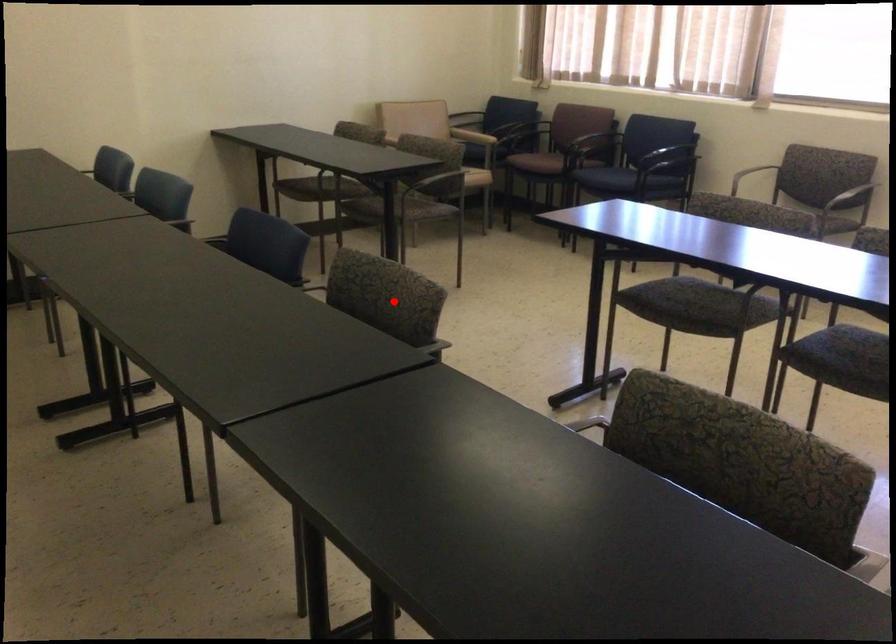
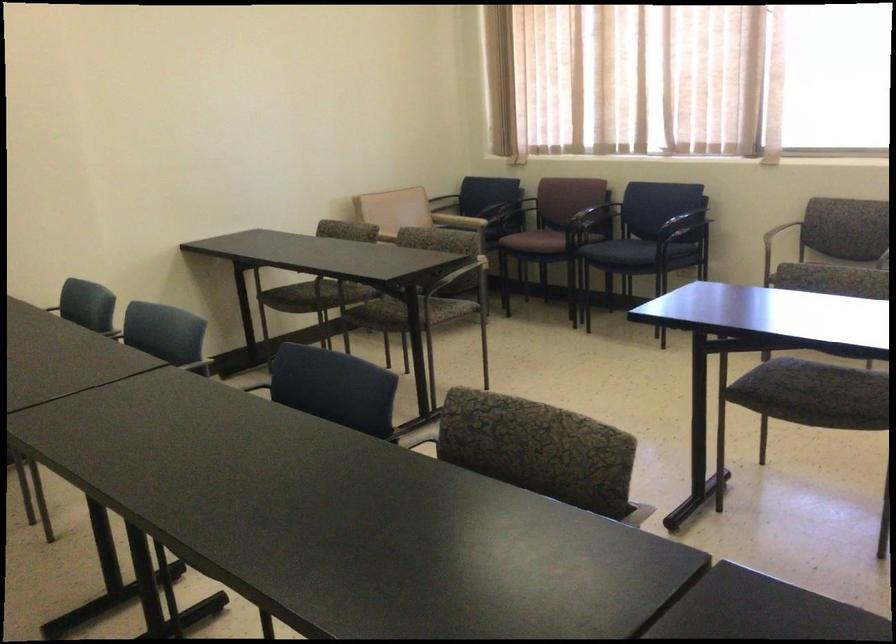
Question: A red point is marked in image1. In image2, is the corresponding 3D point closer to the camera or farther? Reply with the corresponding letter.

Choices:
 (A) The corresponding 3D point is closer.
 (B) The corresponding 3D point is farther.

Answer: (A)